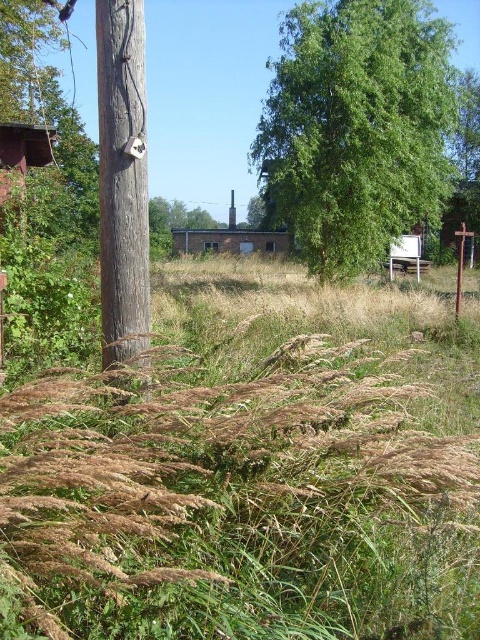
You are a farmer inspecting the field and notice the brown dry grass at lower left and the brown wooden post at left. Which object is wider?

The brown dry grass at lower left is wider than the brown wooden post at left.